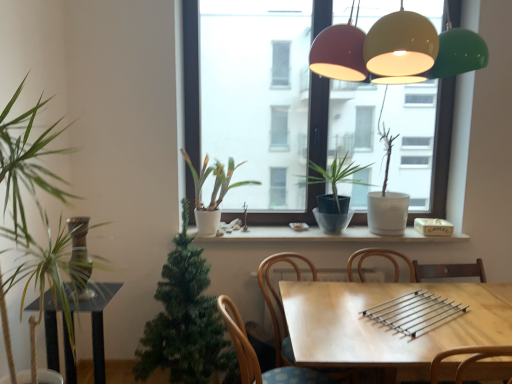
Question: Is white matte plant at center, positioned as the third houseplant in right-to-left order, to the left or to the right of green matte plant at center, marked as the 4th houseplant in a left-to-right arrangement, in the image?

Choices:
 (A) left
 (B) right

Answer: (A)

Question: Is point (215, 226) positioned closer to the camera than point (344, 178)?

Choices:
 (A) closer
 (B) farther

Answer: (A)

Question: Estimate the real-world distances between objects in this image. Which object is closer to the white matte plant at center, placed as the 3th houseplant when sorted from left to right?

Choices:
 (A) black glass coffee table at lower left
 (B) wooden chair at center
 (C) green matte plant at center, marked as the 4th houseplant in a left-to-right arrangement
 (D) white matte pot at center, which is the fifth houseplant in left-to-right order
 (E) wooden table at center

Answer: (C)

Question: Estimate the real-world distances between objects in this image. Which object is farther from the white matte pot at center, which ranks as the 1th houseplant in right-to-left order?

Choices:
 (A) wooden chair at center
 (B) green matte plant at center, the 2th houseplant positioned from the right
 (C) green leafy plant at left, positioned as the fifth houseplant in right-to-left order
 (D) white matte plant at center, positioned as the third houseplant in right-to-left order
 (E) black glass coffee table at lower left

Answer: (C)